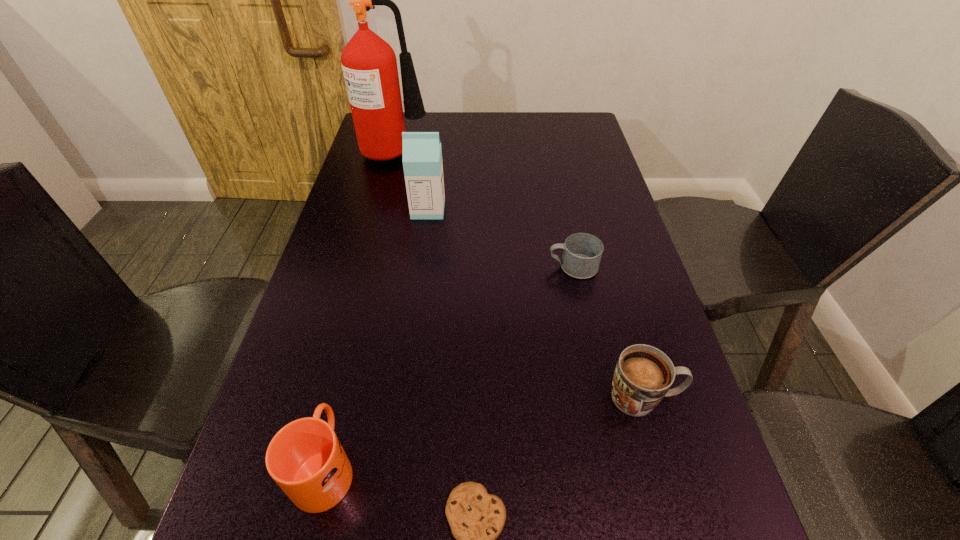
The width and height of the screenshot is (960, 540). Find the location of `mug present at the left edge`. mug present at the left edge is located at coordinates click(x=305, y=458).

What are the coordinates of `object that is at the far left corner` in the screenshot? It's located at (369, 64).

I want to click on vacant space at the far edge of the desktop, so click(x=511, y=122).

Image resolution: width=960 pixels, height=540 pixels. Identify the location of vacant space at the left edge of the desktop. (372, 169).

Locate an element on the screen. This screenshot has height=540, width=960. free space at the right edge of the desktop is located at coordinates (702, 492).

The width and height of the screenshot is (960, 540). In the image, there is a desktop. What are the coordinates of `blank space at the far left corner` in the screenshot? It's located at (405, 122).

Locate an element on the screen. The height and width of the screenshot is (540, 960). free region at the far right corner of the desktop is located at coordinates point(588,136).

Find the location of a particular element. unoccupied area between the tallest object and the second tallest mug is located at coordinates (520, 274).

Where is `free space between the fifth shortest object and the third tallest object`? free space between the fifth shortest object and the third tallest object is located at coordinates (376, 338).

Locate an element on the screen. This screenshot has width=960, height=540. free space that is in between the farthest mug and the fifth nearest object is located at coordinates (500, 238).